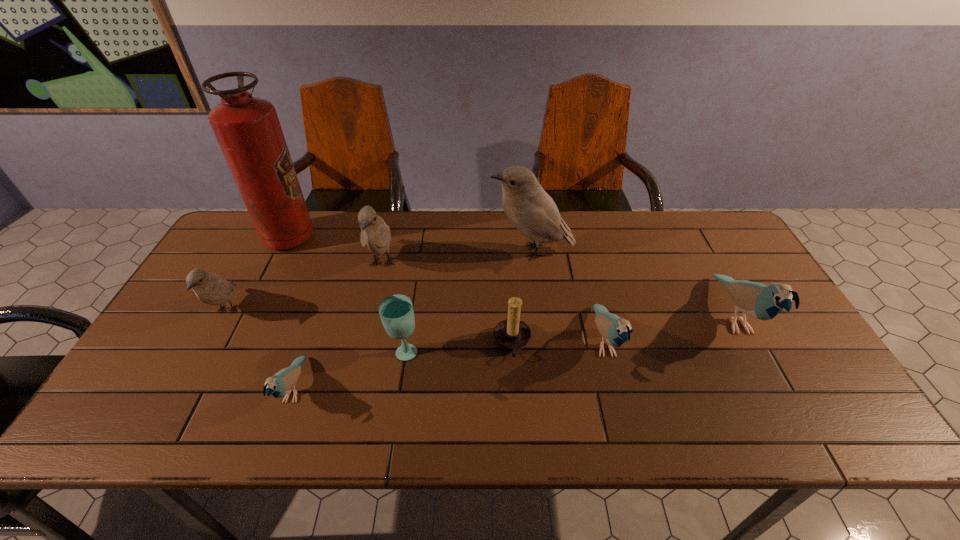
I want to click on the second blue bird from right to left, so click(x=615, y=330).

The height and width of the screenshot is (540, 960). Identify the location of glass. (396, 311).

Identify the location of brown candle holder. (512, 334).

What are the coordinates of `the shortest bird` in the screenshot? It's located at (280, 384).

Find the location of a particular element. The height and width of the screenshot is (540, 960). the leftmost blue bird is located at coordinates (280, 384).

Find the location of `free point located 0.230m on the label side of the tallest object`. free point located 0.230m on the label side of the tallest object is located at coordinates (385, 238).

The height and width of the screenshot is (540, 960). I want to click on vacant space located at the beak of the rightmost white bird, so 435,251.

Image resolution: width=960 pixels, height=540 pixels. Identify the location of free space located 0.160m at the beak of the rightmost white bird. (438, 251).

Image resolution: width=960 pixels, height=540 pixels. In order to click on free location located at the beak of the rightmost white bird in this screenshot , I will do `click(396, 251)`.

This screenshot has width=960, height=540. I want to click on vacant point located at the beak of the second biggest white bird, so click(361, 352).